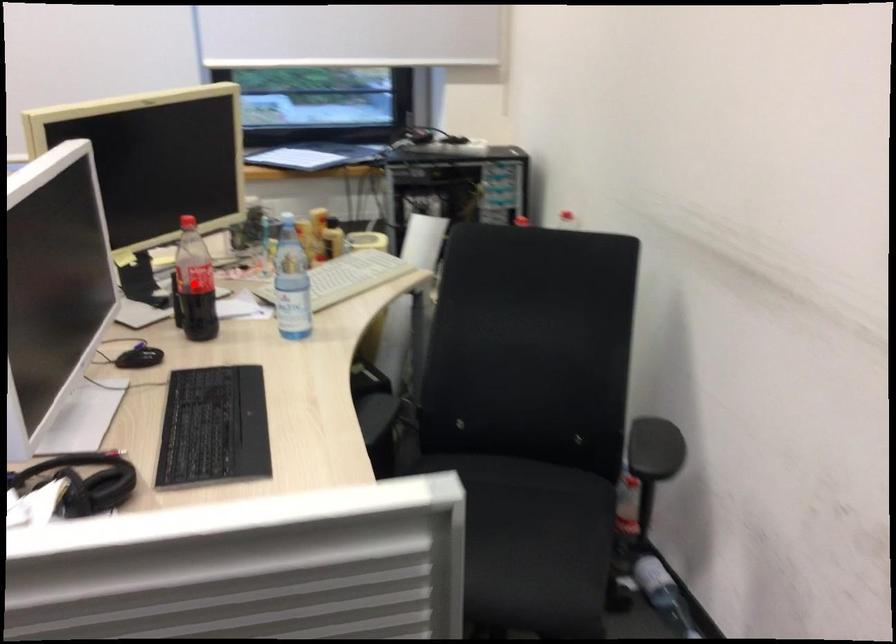
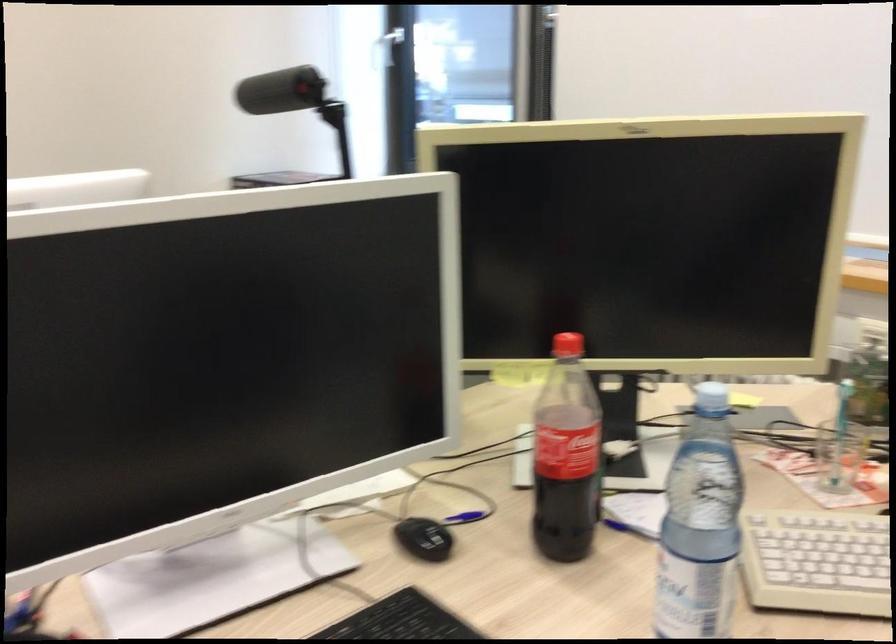
Question: I am providing you with two images of the same scene from different viewpoints. In image1, a red point is highlighted. Considering the same 3D point in image2, which of the following is correct?

Choices:
 (A) It is closer
 (B) It is farther

Answer: (A)